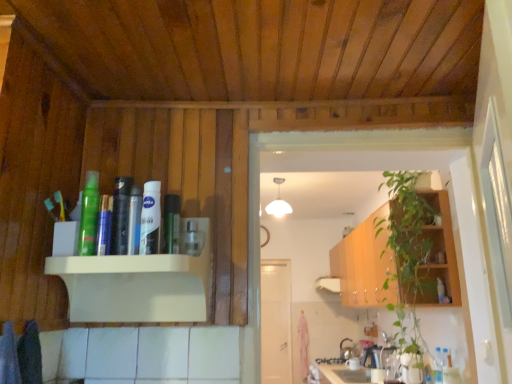
The image size is (512, 384). What are the coordinates of `green matte bottle at upper center, the 1th toiletry from the right` in the screenshot? It's located at (170, 224).

Image resolution: width=512 pixels, height=384 pixels. Describe the element at coordinates (89, 215) in the screenshot. I see `green matte spray can at upper left, acting as the 1th toiletry starting from the left` at that location.

You are a GUI agent. You are given a task and a screenshot of the screen. Output one action in this format:
    pyautogui.click(x=<x>, y=<y>)
    Task: Click on the green wood cabinet at right
    The width and height of the screenshot is (512, 384).
    Given the screenshot: What is the action you would take?
    pyautogui.click(x=368, y=263)

The width and height of the screenshot is (512, 384). Describe the element at coordinates (413, 254) in the screenshot. I see `green leafy plant at right` at that location.

Identify the location of green leafy plant at right. The height and width of the screenshot is (384, 512). (413, 254).

In order to face white glossy nivea cream at upper center, acting as the 2th toiletry starting from the right, should I rotate leftwards or rightwards?

It's best to rotate left around 13.887 degrees.

Describe the element at coordinates (192, 239) in the screenshot. I see `clear plastic bottle at center` at that location.

At what (x,y) coordinates should I click in order to perform the action: click on green matte bottle at upper center, the third toiletry in the left-to-right sequence. Please return your answer as a coordinate pair (x, y). This screenshot has height=384, width=512. Looking at the image, I should click on (170, 224).

In order to click on bottle in front of the white matte door at center in this screenshot , I will do `click(192, 239)`.

Considering the relative positions of clear plastic bottle at center and white matte door at center in the image provided, is clear plastic bottle at center behind white matte door at center?

No, clear plastic bottle at center is closer to the camera.

Does point (180, 250) appear closer or farther from the camera than point (278, 383)?

Point (180, 250) is closer to the camera than point (278, 383).

From the image's perspective, relative to white matte door at center, is clear plastic bottle at center above or below?

From the image's perspective, clear plastic bottle at center appears above white matte door at center.

Which of these two, green matte bottle at upper center, the 1th toiletry from the right, or green leafy plant at right, stands shorter?

green matte bottle at upper center, the 1th toiletry from the right.

Is green matte bottle at upper center, the 1th toiletry from the right, positioned with its back to green leafy plant at right?

No, green matte bottle at upper center, the 1th toiletry from the right,'s orientation is not away from green leafy plant at right.

Is green matte bottle at upper center, the third toiletry in the left-to-right sequence, wider than green leafy plant at right?

No, green matte bottle at upper center, the third toiletry in the left-to-right sequence, is not wider than green leafy plant at right.

Is green matte spray can at upper left, acting as the 1th toiletry starting from the left, further to camera compared to white matte door at center?

No, green matte spray can at upper left, acting as the 1th toiletry starting from the left, is closer to the viewer.

Considering the relative positions of green matte spray can at upper left, which is the 3th toiletry from right to left, and white matte door at center in the image provided, is green matte spray can at upper left, which is the 3th toiletry from right to left, to the right of white matte door at center from the viewer's perspective?

In fact, green matte spray can at upper left, which is the 3th toiletry from right to left, is to the left of white matte door at center.

From the image's perspective, is green matte spray can at upper left, acting as the 1th toiletry starting from the left, above or below white matte door at center?

From the image's perspective, green matte spray can at upper left, acting as the 1th toiletry starting from the left, appears above white matte door at center.

Is green matte spray can at upper left, acting as the 1th toiletry starting from the left, facing away from white matte door at center?

Correct, green matte spray can at upper left, acting as the 1th toiletry starting from the left, is looking away from white matte door at center.

From the picture: Which is less distant, (409, 326) or (391, 262)?

Point (409, 326) is positioned farther from the camera compared to point (391, 262).

Is green leafy plant at right smaller than green wood cabinet at right?

Yes, green leafy plant at right is smaller than green wood cabinet at right.

From the image's perspective, is green leafy plant at right over green wood cabinet at right?

Correct, green leafy plant at right appears higher than green wood cabinet at right in the image.

Is green leafy plant at right facing towards green wood cabinet at right?

Yes, green leafy plant at right is turned towards green wood cabinet at right.

Does point (197, 232) come farther from viewer compared to point (391, 309)?

That is False.

Between clear plastic bottle at center and green leafy plant at right, which one appears on the right side from the viewer's perspective?

From the viewer's perspective, green leafy plant at right appears more on the right side.

From the image's perspective, which is above, clear plastic bottle at center or green leafy plant at right?

clear plastic bottle at center is shown above in the image.

Considering the sizes of objects clear plastic bottle at center and green leafy plant at right in the image provided, who is smaller, clear plastic bottle at center or green leafy plant at right?

clear plastic bottle at center.

Does green wood cabinet at right lie behind white matte door at center?

No, green wood cabinet at right is closer to the viewer.

From the picture: Could you tell me if green wood cabinet at right is facing white matte door at center?

No, green wood cabinet at right is not aimed at white matte door at center.

Does green wood cabinet at right have a greater width compared to white matte door at center?

Yes.

Is white glossy nivea cream at upper center, acting as the 2th toiletry starting from the right, turned away from clear plastic bottle at center?

No.

Based on the photo, from the image's perspective, which object appears higher, white glossy nivea cream at upper center, acting as the 2th toiletry starting from the right, or clear plastic bottle at center?

white glossy nivea cream at upper center, acting as the 2th toiletry starting from the right, is shown above in the image.

From their relative heights in the image, would you say white glossy nivea cream at upper center, which ranks as the 2th toiletry in left-to-right order, is taller or shorter than clear plastic bottle at center?

white glossy nivea cream at upper center, which ranks as the 2th toiletry in left-to-right order, is taller than clear plastic bottle at center.

Is white glossy nivea cream at upper center, which ranks as the 2th toiletry in left-to-right order, located outside clear plastic bottle at center?

Absolutely, white glossy nivea cream at upper center, which ranks as the 2th toiletry in left-to-right order, is external to clear plastic bottle at center.

Image resolution: width=512 pixels, height=384 pixels. I want to click on door lying below the clear plastic bottle at center (from the image's perspective), so click(276, 322).

From the image's perspective, starting from the green leafy plant at right, which toiletry is the 1st one above? Please provide its 2D coordinates.

[(170, 224)]

Considering their positions, is white glossy nivea cream at upper center, which ranks as the 2th toiletry in left-to-right order, positioned further to green wood cabinet at right than white matte door at center?

The object further to green wood cabinet at right is white glossy nivea cream at upper center, which ranks as the 2th toiletry in left-to-right order.

Which object lies further to the anchor point green leafy plant at right, green matte bottle at upper center, the third toiletry in the left-to-right sequence, or green matte spray can at upper left, which is the 3th toiletry from right to left?

The object further to green leafy plant at right is green matte spray can at upper left, which is the 3th toiletry from right to left.

Based on their spatial positions, is green leafy plant at right or green wood cabinet at right closer to white glossy nivea cream at upper center, acting as the 2th toiletry starting from the right?

The object closer to white glossy nivea cream at upper center, acting as the 2th toiletry starting from the right, is green leafy plant at right.

Which object lies further to the anchor point green matte spray can at upper left, acting as the 1th toiletry starting from the left, green leafy plant at right or green matte bottle at upper center, the 1th toiletry from the right?

green leafy plant at right is positioned further to the anchor green matte spray can at upper left, acting as the 1th toiletry starting from the left.

Estimate the real-world distances between objects in this image. Which object is closer to green matte bottle at upper center, the third toiletry in the left-to-right sequence, green leafy plant at right or clear plastic bottle at center?

Based on the image, clear plastic bottle at center appears to be nearer to green matte bottle at upper center, the third toiletry in the left-to-right sequence.

Based on their spatial positions, is green matte spray can at upper left, which is the 3th toiletry from right to left, or green leafy plant at right further from clear plastic bottle at center?

green leafy plant at right.

Estimate the real-world distances between objects in this image. Which object is closer to green matte spray can at upper left, acting as the 1th toiletry starting from the left, green matte bottle at upper center, the 1th toiletry from the right, or green leafy plant at right?

green matte bottle at upper center, the 1th toiletry from the right, lies closer to green matte spray can at upper left, acting as the 1th toiletry starting from the left, than the other object.

Considering their positions, is clear plastic bottle at center positioned closer to white matte door at center than green matte spray can at upper left, acting as the 1th toiletry starting from the left?

Among the two, clear plastic bottle at center is located nearer to white matte door at center.

Image resolution: width=512 pixels, height=384 pixels. In order to click on houseplant between clear plastic bottle at center and white matte door at center from front to back in this screenshot , I will do `click(413, 254)`.

What are the coordinates of `bottle positioned between white glossy nivea cream at upper center, which ranks as the 2th toiletry in left-to-right order, and white matte door at center from near to far` in the screenshot? It's located at (192, 239).

Identify the location of houseplant between green matte bottle at upper center, the third toiletry in the left-to-right sequence, and white matte door at center in the front-back direction. (413, 254).

I want to click on cabinetry between green matte spray can at upper left, which is the 3th toiletry from right to left, and green leafy plant at right from left to right, so click(x=368, y=263).